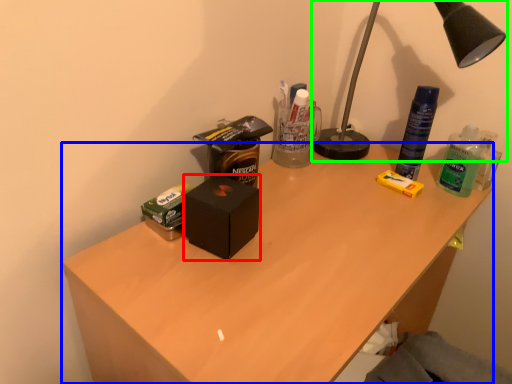
Question: Based on their relative distances, which object is nearer to box (highlighted by a red box)? Choose from desk (highlighted by a blue box) and lamp (highlighted by a green box).

Choices:
 (A) desk
 (B) lamp

Answer: (A)